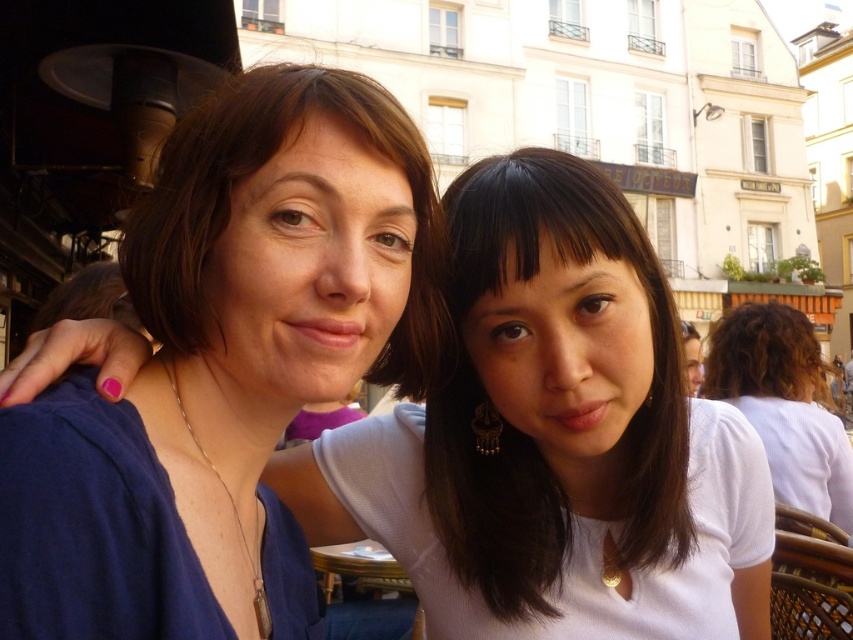
You are a photographer setting up for a group photo. You notice two people in the center wearing white tops. The person on the left is wearing a white matte shirt at center and the one on the right has a smooth white blouse at center. Which top will appear larger in the photo?

The white matte shirt at center will appear larger in the photo because it is bigger than the smooth white blouse at center.

You are a photographer adjusting your camera to focus on the two people in the scene. You notice the white matte shirt at center and the smooth white blouse at center. Which clothing item is closer to the camera?

The white matte shirt at center is positioned under the smooth white blouse at center, so the smooth white blouse at center is closer to the camera.